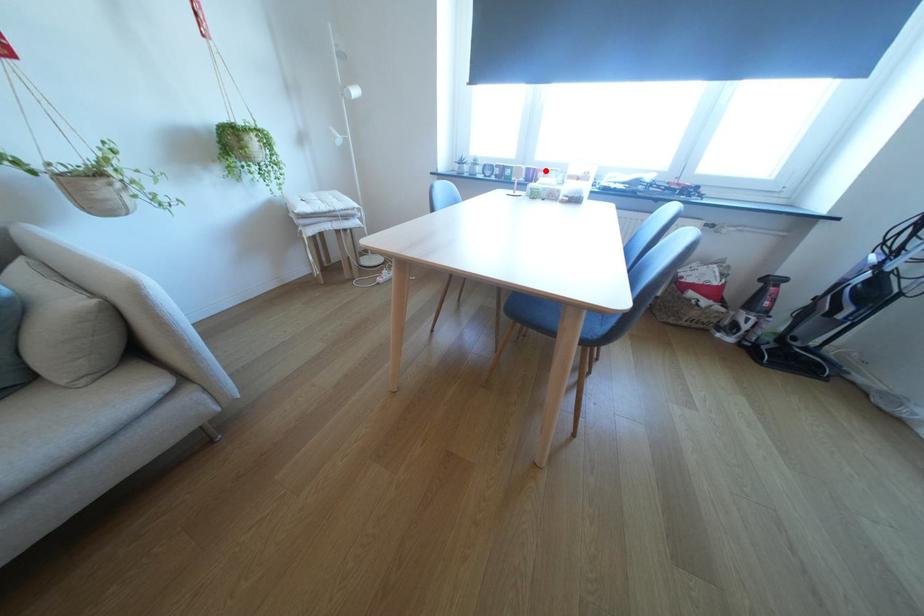
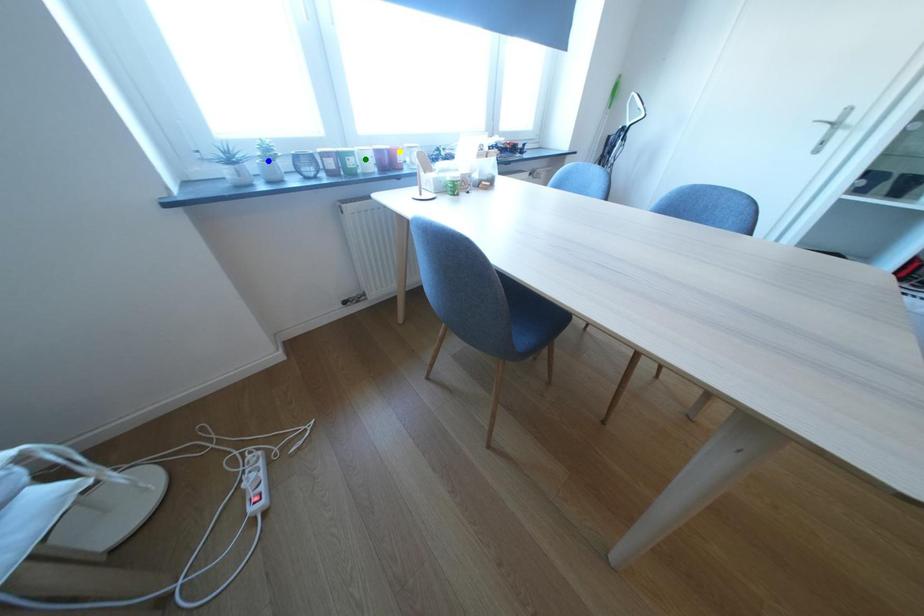
Question: I am providing you with two images of the same scene from different viewpoints. A red point is marked on the first image. You are given multiple points on the second image. Which point in image 2 is actually the same real-world point as the red point in image 1?

Choices:
 (A) green point
 (B) blue point
 (C) yellow point

Answer: (C)